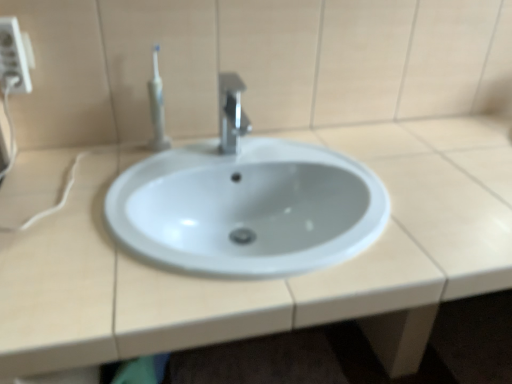
The image size is (512, 384). Find the location of `free space above white glossy sink at center (from a real-world perspective)`. free space above white glossy sink at center (from a real-world perspective) is located at coordinates (345, 184).